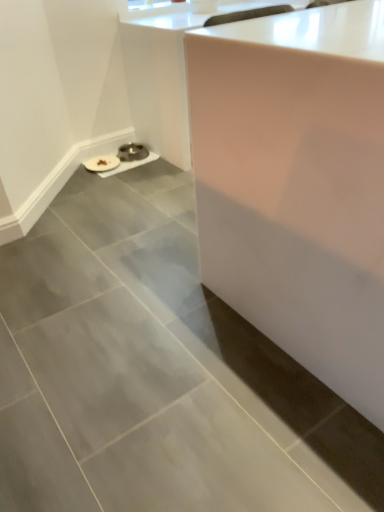
Describe the element at coordinates (132, 152) in the screenshot. This screenshot has height=512, width=384. I see `metallic bowl at lower left` at that location.

At what (x,y) coordinates should I click in order to perform the action: click on metallic bowl at lower left. Please return your answer as a coordinate pair (x, y). The height and width of the screenshot is (512, 384). Looking at the image, I should click on (132, 152).

What are the coordinates of `metallic bowl at lower left` in the screenshot? It's located at (132, 152).